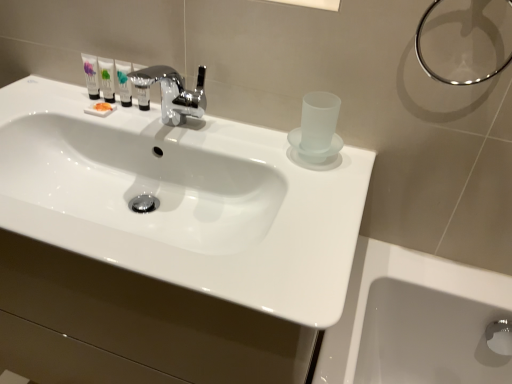
The height and width of the screenshot is (384, 512). Find the location of `free space in front of matte white tube at upper left, the 1th mouthwash positioned from the left`. free space in front of matte white tube at upper left, the 1th mouthwash positioned from the left is located at coordinates (73, 120).